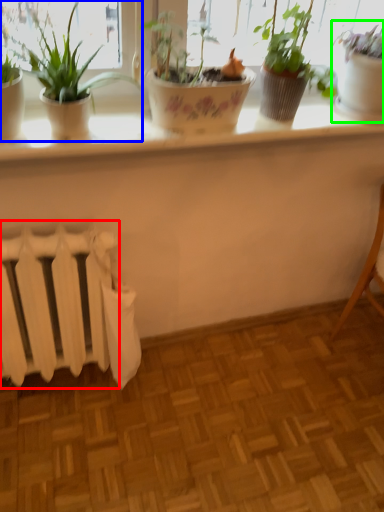
Question: Which is nearer to the radiator (highlighted by a red box)? houseplant (highlighted by a blue box) or houseplant (highlighted by a green box).

Choices:
 (A) houseplant
 (B) houseplant

Answer: (A)